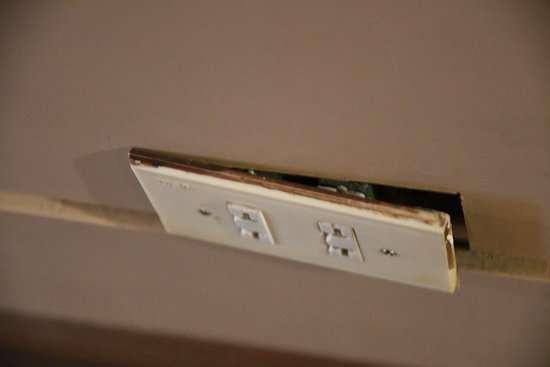
Locate an element on the screen. The image size is (550, 367). wall is located at coordinates (365, 84).